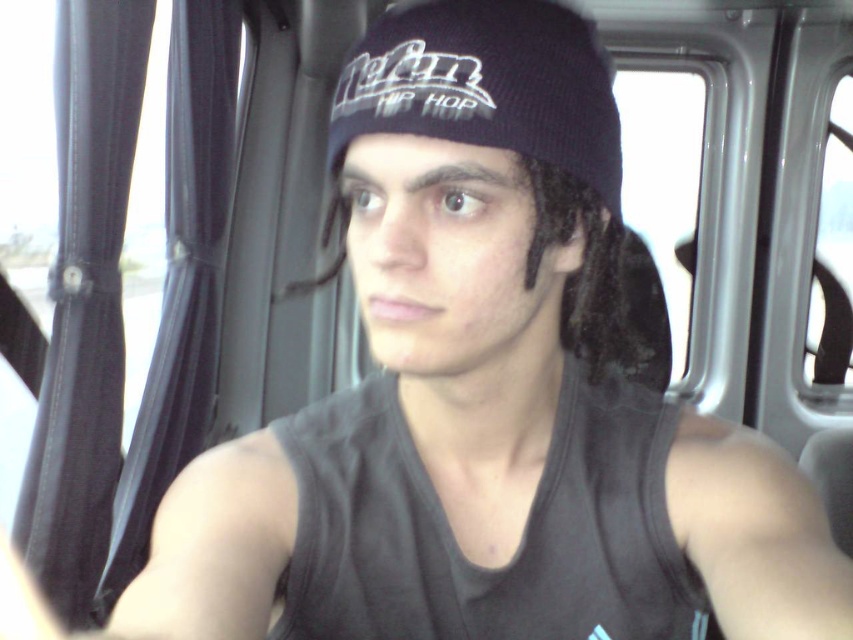
Question: Does smooth skin muscle at lower right appear on the right side of muscle at upper right?

Choices:
 (A) yes
 (B) no

Answer: (A)

Question: Is smooth skin muscle at lower right positioned in front of muscle at upper right?

Choices:
 (A) yes
 (B) no

Answer: (A)

Question: Is smooth skin muscle at lower right further to the viewer compared to muscle at upper right?

Choices:
 (A) no
 (B) yes

Answer: (A)

Question: Which point is farther from the camera taking this photo?

Choices:
 (A) (784, 557)
 (B) (181, 540)

Answer: (B)

Question: Which point is closer to the camera?

Choices:
 (A) smooth skin muscle at lower right
 (B) muscle at upper right

Answer: (A)